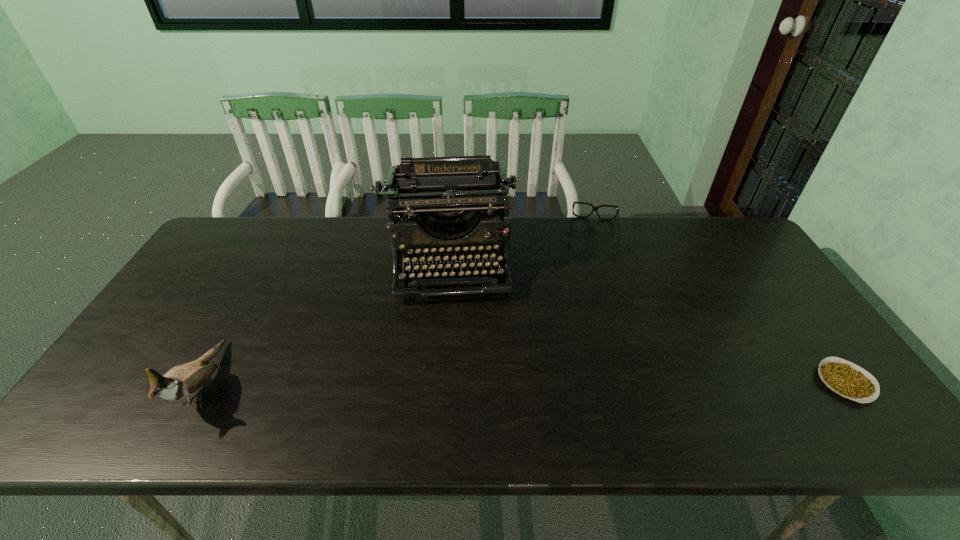
The width and height of the screenshot is (960, 540). Find the location of `vacant space on the desktop that is between the bird and the legume and is positioned on the typing side of the tallest object`. vacant space on the desktop that is between the bird and the legume and is positioned on the typing side of the tallest object is located at coordinates (452, 383).

I want to click on free space on the desktop that is between the bird and the shortest object and is positioned with the lenses facing outward on the third object from left to right, so click(x=590, y=382).